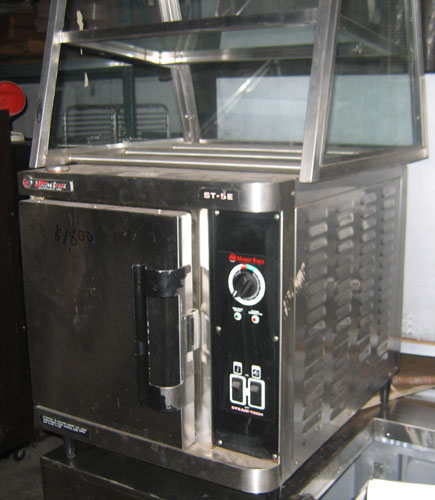
Image resolution: width=435 pixels, height=500 pixels. I want to click on metal frame, so click(321, 109), click(382, 157), click(50, 100), click(140, 30), click(418, 49).